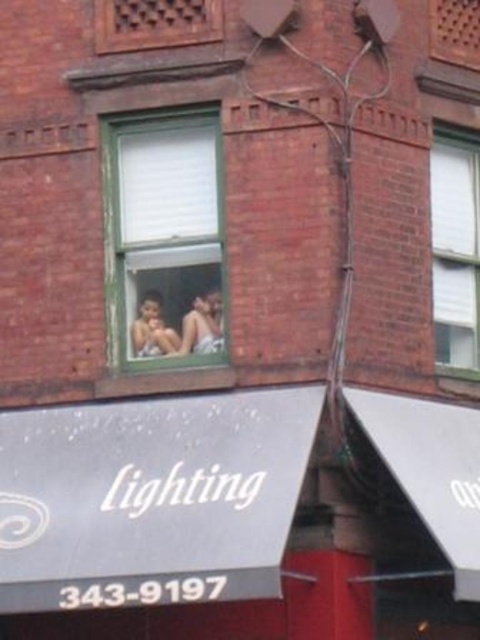
You are a delivery person trying to find the correct address. You see the green wooden window at center and the smooth skin person at center. Which object is located higher up in the image?

The green wooden window at center is positioned over the smooth skin person at center, so it is higher up in the image.

Looking at this image, you are standing 5 meters away from the building. You want to reach the white matte window at upper right first and then the matte brown wooden window at upper center. Can you walk directly from your current position to both windows without needing to change your path?

The distance between the white matte window at upper right and the matte brown wooden window at upper center is 9.70 meters. Since you are only 5 meters away from the building, the windows are farther apart than your distance from the building, so you can walk directly to both without needing to adjust your path.